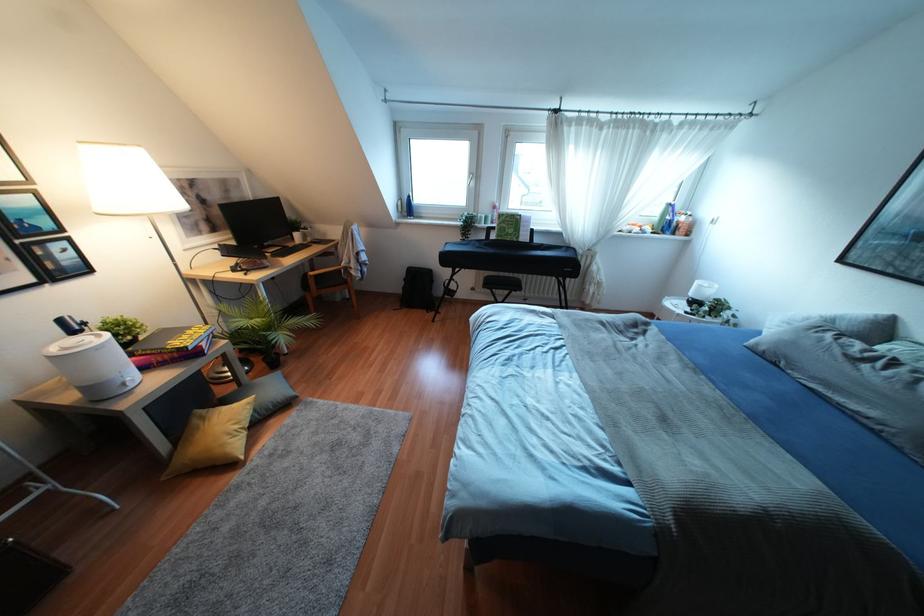
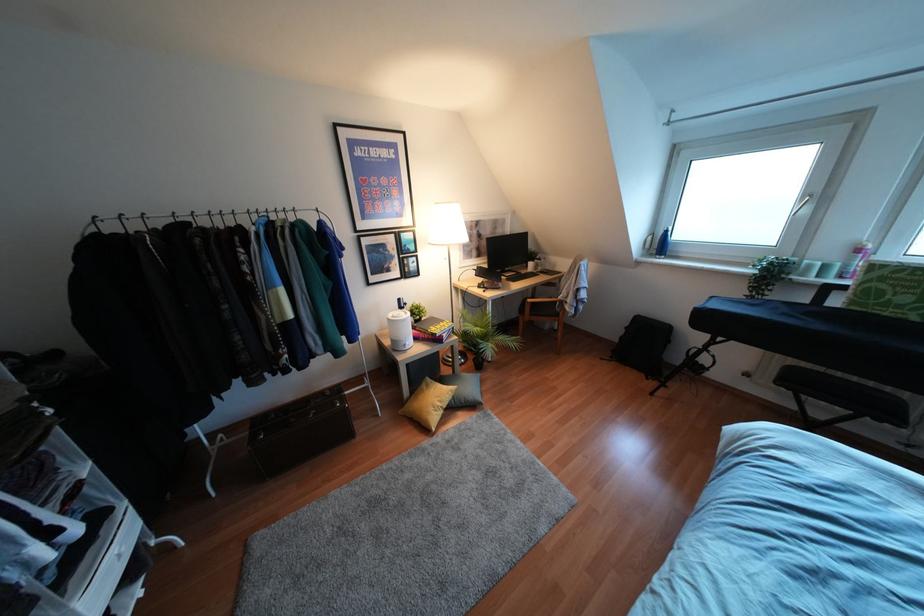
Find the pixel in the second image that matches (188,331) in the first image.

(441, 323)